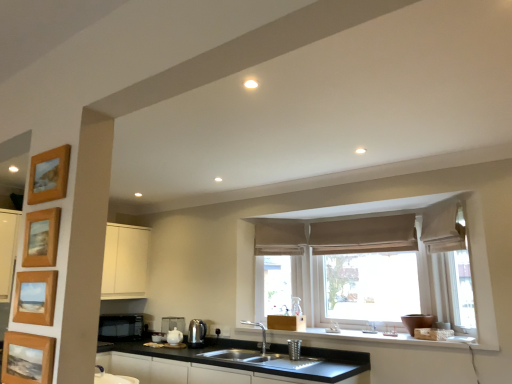
Question: Is white ceramic teapot at lower center, which is counted as the third appliance, starting from the front, facing towards wooden picture frame at upper left, the third picture frame from the bottom?

Choices:
 (A) yes
 (B) no

Answer: (B)

Question: From a real-world perspective, is white ceramic teapot at lower center, the 3th appliance from the right, located beneath wooden picture frame at upper left, marked as the 2th picture frame in a top-to-bottom arrangement?

Choices:
 (A) yes
 (B) no

Answer: (A)

Question: From a real-world perspective, is white ceramic teapot at lower center, the 2th appliance positioned from the left, physically above wooden picture frame at upper left, the third picture frame from the bottom?

Choices:
 (A) no
 (B) yes

Answer: (A)

Question: Considering the relative sizes of white ceramic teapot at lower center, positioned as the 2th appliance in back-to-front order, and wooden picture frame at upper left, marked as the 2th picture frame in a top-to-bottom arrangement, in the image provided, is white ceramic teapot at lower center, positioned as the 2th appliance in back-to-front order, taller than wooden picture frame at upper left, marked as the 2th picture frame in a top-to-bottom arrangement,?

Choices:
 (A) yes
 (B) no

Answer: (A)

Question: Is white ceramic teapot at lower center, the 2th appliance positioned from the left, to the right of wooden picture frame at upper left, the third picture frame from the bottom, from the viewer's perspective?

Choices:
 (A) yes
 (B) no

Answer: (B)

Question: In terms of size, does white ceramic teapot at lower center, which is counted as the third appliance, starting from the front, appear bigger or smaller than brown fabric curtain at center, which is counted as the first curtain, starting from the left?

Choices:
 (A) big
 (B) small

Answer: (B)

Question: Is point (164, 319) positioned closer to the camera than point (297, 230)?

Choices:
 (A) closer
 (B) farther

Answer: (B)

Question: Is white ceramic teapot at lower center, which is counted as the third appliance, starting from the front, wider or thinner than brown fabric curtain at center, the 3th curtain viewed from the right?

Choices:
 (A) wide
 (B) thin

Answer: (B)

Question: Relative to brown fabric curtain at center, which is counted as the first curtain, starting from the left, is white ceramic teapot at lower center, the 3th appliance from the right, in front or behind?

Choices:
 (A) behind
 (B) front

Answer: (A)

Question: From the image's perspective, is beige fabric curtain at upper right, the first curtain viewed from the right, located above or below satin silver kettle at lower center, which ranks as the 3th appliance in left-to-right order?

Choices:
 (A) below
 (B) above

Answer: (B)

Question: In terms of size, does beige fabric curtain at upper right, the first curtain viewed from the right, appear bigger or smaller than satin silver kettle at lower center, marked as the 2th appliance in a right-to-left arrangement?

Choices:
 (A) small
 (B) big

Answer: (B)

Question: In the image, is beige fabric curtain at upper right, the first curtain viewed from the right, positioned in front of or behind satin silver kettle at lower center, which ranks as the 3th appliance in left-to-right order?

Choices:
 (A) behind
 (B) front

Answer: (B)

Question: From a real-world perspective, is beige fabric curtain at upper right, the first curtain viewed from the right, above or below satin silver kettle at lower center, the 2th appliance viewed from the front?

Choices:
 (A) below
 (B) above

Answer: (B)

Question: In terms of size, does beige fabric curtain at right appear bigger or smaller than wooden framed picture at left, the 2th picture frame positioned from the bottom?

Choices:
 (A) big
 (B) small

Answer: (A)

Question: Is beige fabric curtain at right situated inside wooden framed picture at left, the 2th picture frame positioned from the bottom, or outside?

Choices:
 (A) inside
 (B) outside

Answer: (B)